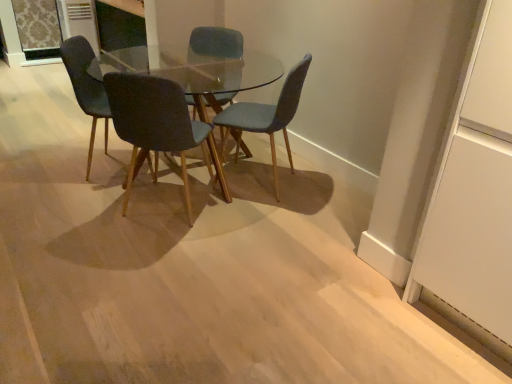
I want to click on vacant area that lies between dark gray fabric chair at center, the 2th chair positioned from the left, and transparent glass door at upper right, so [295, 259].